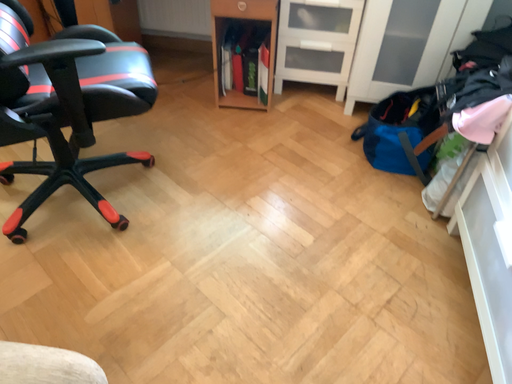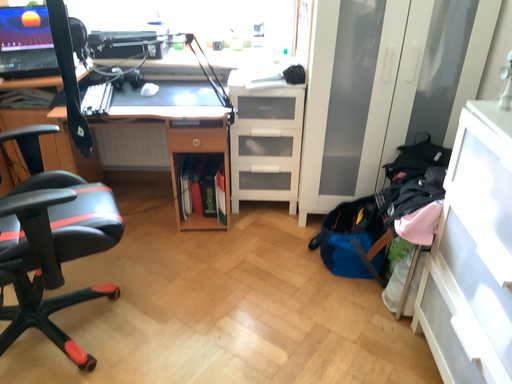
Question: How did the camera likely rotate when shooting the video?

Choices:
 (A) rotated upward
 (B) rotated downward

Answer: (A)